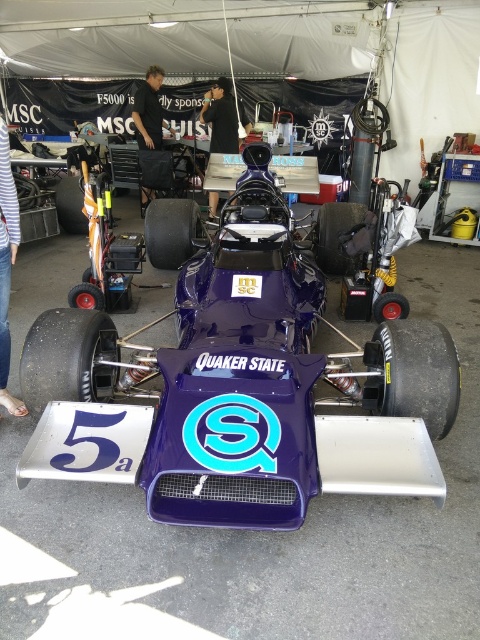
You are a photographer standing at the back of the pit area. You want to take a photo of the purple glossy race car at center and the striped fabric pants at lower left. Which object should you focus on first if you want to capture both in the same frame without moving the camera?

The purple glossy race car at center is much taller than the striped fabric pants at lower left, so you should focus on the purple glossy race car at center first to ensure it fits within the frame.

You are a photographer at a motorsport event and need to capture a photo of the purple glossy race car at center and the black fabric shirt at upper center. Which object should you focus on first if you want to ensure both are in the frame without moving the camera?

You should focus on the purple glossy race car at center first because it is wider than the black fabric shirt at upper center, so positioning the camera to include the wider object ensures the narrower one will also be in frame.